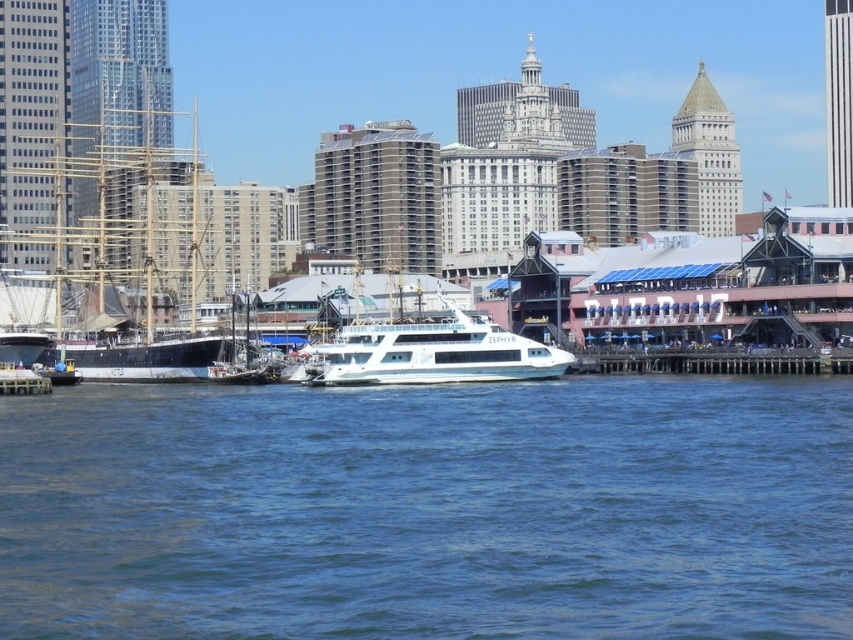
You are standing at the point with coordinates point (50, 243) and want to see the point with coordinates point (461, 316). Is there any obstruction between you and that point?

Point (50, 243) is behind point (461, 316), so there is an obstruction between them.

You are a photographer planning to take a photo of the waterfront scene. You want to ensure both the wooden ship at left and the white glossy ferry at center are clearly visible in your shot. Considering their heights, which object should you focus on first to ensure proper framing?

The wooden ship at left is much taller than the white glossy ferry at center, so you should focus on the wooden ship at left first to account for its height in the frame.

You are standing on the dock and looking out at the scene. Which object is closer to you between the blue liquid water at lower center and the wooden ship at left?

The blue liquid water at lower center is closer to you because it is in front of the wooden ship at left.